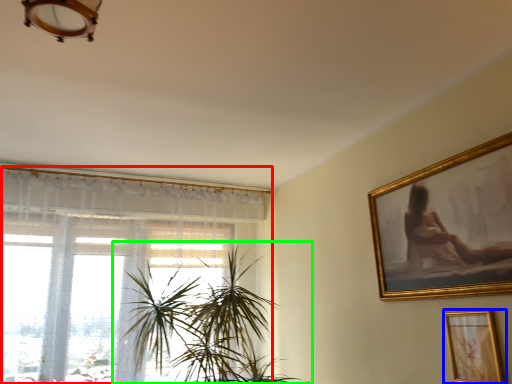
Question: Considering the real-world distances, which object is closest to window (highlighted by a red box)? picture frame (highlighted by a blue box) or houseplant (highlighted by a green box).

Choices:
 (A) picture frame
 (B) houseplant

Answer: (B)